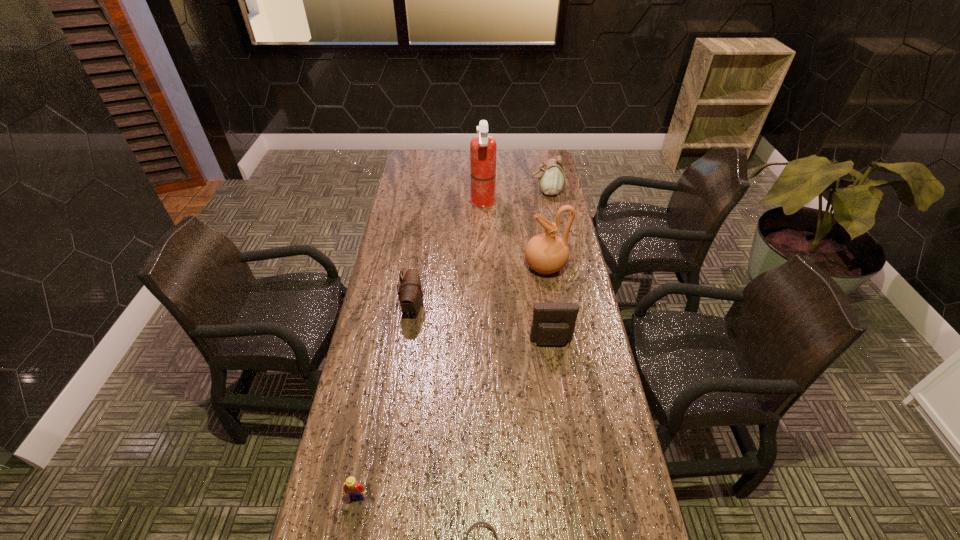
Where is `free location located with the handle and hose on the fire extinguisher`? The width and height of the screenshot is (960, 540). free location located with the handle and hose on the fire extinguisher is located at coordinates (439, 202).

Find the location of a particular element. free space located 0.270m with the handle and hose on the fire extinguisher is located at coordinates (409, 202).

Identify the location of free space located on the spout of the fifth nearest object. tap(457, 267).

The width and height of the screenshot is (960, 540). Find the location of `vacant area located 0.160m on the spout of the fifth nearest object`. vacant area located 0.160m on the spout of the fifth nearest object is located at coordinates (481, 267).

Locate an element on the screen. The width and height of the screenshot is (960, 540). free space located on the spout of the fifth nearest object is located at coordinates (497, 267).

At what (x,y) coordinates should I click in order to perform the action: click on vacant space located 0.210m on the front-facing side of the farthest pouch. Please return your answer as a coordinate pair (x, y). The width and height of the screenshot is (960, 540). Looking at the image, I should click on (483, 192).

The height and width of the screenshot is (540, 960). What are the coordinates of `free spot located on the front-facing side of the farthest pouch` in the screenshot? It's located at (476, 192).

Find the location of a particular element. The width and height of the screenshot is (960, 540). vacant space located on the front-facing side of the farthest pouch is located at coordinates (496, 192).

This screenshot has height=540, width=960. What are the coordinates of `free space located with an open flap on the fifth farthest object` in the screenshot? It's located at (568, 460).

This screenshot has width=960, height=540. Identify the location of vacant space located 0.370m with the flap open on the shortest pouch. (533, 306).